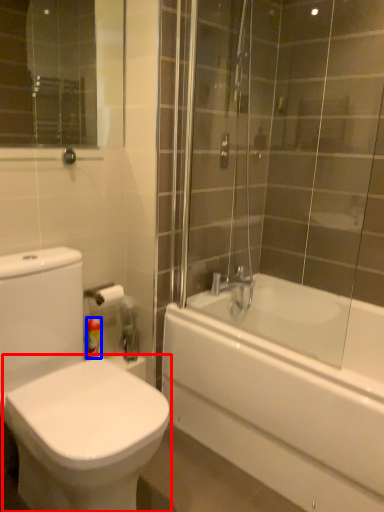
Question: Which object is further to the camera taking this photo, bidet (highlighted by a red box) or toiletry (highlighted by a blue box)?

Choices:
 (A) bidet
 (B) toiletry

Answer: (B)